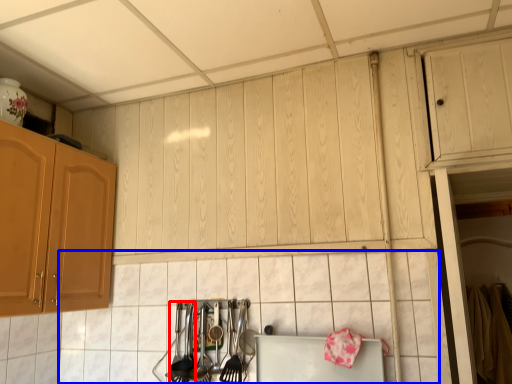
Question: Which point is closer to the camera, silverware (highlighted by a red box) or tile (highlighted by a blue box)?

Choices:
 (A) silverware
 (B) tile

Answer: (B)